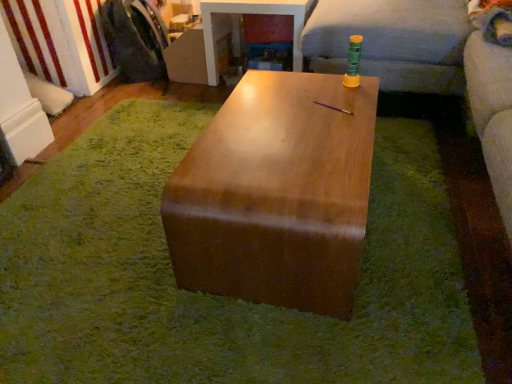
You are a GUI agent. You are given a task and a screenshot of the screen. Output one action in this format:
    pyautogui.click(x=<x>, y=<y>)
    Task: Click on the vacant space to the left of glossy wood table at center, which appears as the 1th table when ordered from the bottom
    The height and width of the screenshot is (384, 512).
    Given the screenshot: What is the action you would take?
    pyautogui.click(x=99, y=217)